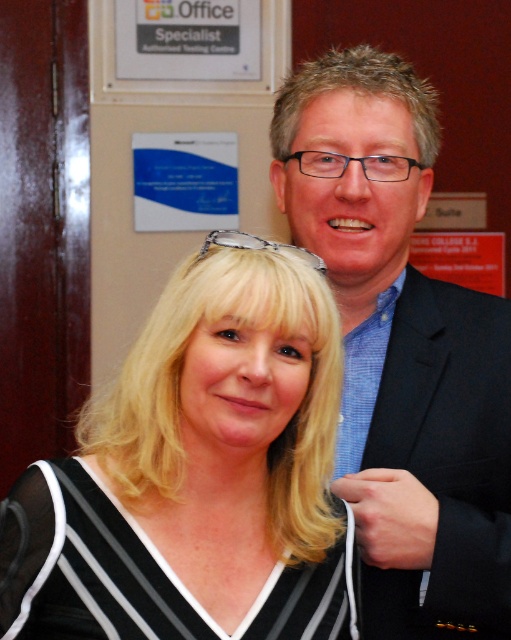
You are attending a formal event and need to choose an outfit. You see the black striped blouse at center and the black striped fabric dress at center in the image. Which one is longer in length?

The black striped blouse at center is taller than the black striped fabric dress at center, so the blouse is longer in length.

You are a photographer setting up for an event. You need to focus your camera on the black striped fabric dress at center. However, there is a black textured suit at upper right in the way. Can you adjust your camera angle to capture the dress without the suit blocking it?

The black textured suit at upper right is closer to the viewer than the black striped fabric dress at center. By adjusting the camera angle slightly downward or to the side, you can position the dress in the frame while moving the suit out of the way, ensuring it doesn

You are a photographer trying to capture a candid shot of the man in the dark suit jacket. The frame of your camera shows a grid with a point marked at coordinates (x=402, y=349). Where should you aim your camera to ensure the man in the dark suit jacket is in focus?

The point at coordinates (x=402, y=349) indicates the location of the black textured suit at upper right. Aim your camera at that point to focus on the man in the dark suit jacket.